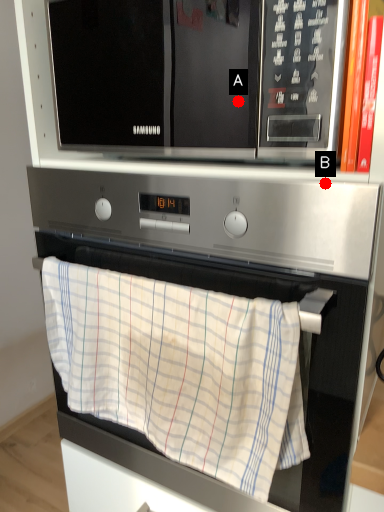
Question: Two points are circled on the image, labeled by A and B beside each circle. Which of the following is the closest to the observer?

Choices:
 (A) A is closer
 (B) B is closer

Answer: (B)